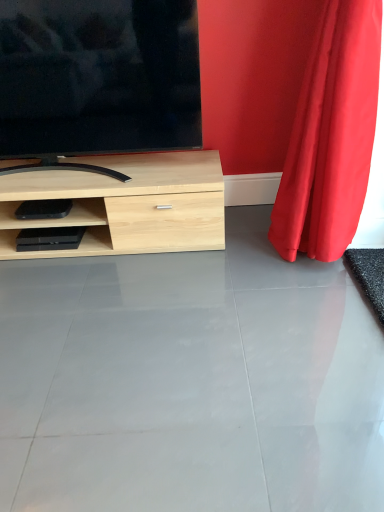
Question: Is red velvet curtain at right taller than matte black tv at upper left?

Choices:
 (A) no
 (B) yes

Answer: (B)

Question: Considering the relative sizes of red velvet curtain at right and matte black tv at upper left in the image provided, is red velvet curtain at right bigger than matte black tv at upper left?

Choices:
 (A) yes
 (B) no

Answer: (A)

Question: Can you confirm if red velvet curtain at right is positioned to the right of matte black tv at upper left?

Choices:
 (A) yes
 (B) no

Answer: (A)

Question: Does red velvet curtain at right lie behind matte black tv at upper left?

Choices:
 (A) yes
 (B) no

Answer: (B)

Question: Is red velvet curtain at right directly adjacent to matte black tv at upper left?

Choices:
 (A) no
 (B) yes

Answer: (A)

Question: Considering the positions of point (183, 123) and point (193, 337), is point (183, 123) closer or farther from the camera than point (193, 337)?

Choices:
 (A) closer
 (B) farther

Answer: (B)

Question: From a real-world perspective, is matte black tv at upper left positioned above or below gray glossy concrete at center?

Choices:
 (A) above
 (B) below

Answer: (A)

Question: Is matte black tv at upper left bigger or smaller than gray glossy concrete at center?

Choices:
 (A) small
 (B) big

Answer: (B)

Question: Considering their positions, is matte black tv at upper left located in front of or behind gray glossy concrete at center?

Choices:
 (A) behind
 (B) front

Answer: (A)

Question: Do you think red velvet curtain at right is within gray glossy concrete at center, or outside of it?

Choices:
 (A) outside
 (B) inside

Answer: (A)

Question: Considering the positions of red velvet curtain at right and gray glossy concrete at center in the image, is red velvet curtain at right wider or thinner than gray glossy concrete at center?

Choices:
 (A) thin
 (B) wide

Answer: (A)

Question: Considering the relative positions of red velvet curtain at right and gray glossy concrete at center in the image provided, is red velvet curtain at right to the left or to the right of gray glossy concrete at center?

Choices:
 (A) right
 (B) left

Answer: (A)

Question: In terms of size, does red velvet curtain at right appear bigger or smaller than gray glossy concrete at center?

Choices:
 (A) big
 (B) small

Answer: (A)

Question: In the image, is red velvet curtain at right positioned in front of or behind matte black tv at upper left?

Choices:
 (A) behind
 (B) front

Answer: (B)

Question: From their relative heights in the image, would you say red velvet curtain at right is taller or shorter than matte black tv at upper left?

Choices:
 (A) short
 (B) tall

Answer: (B)